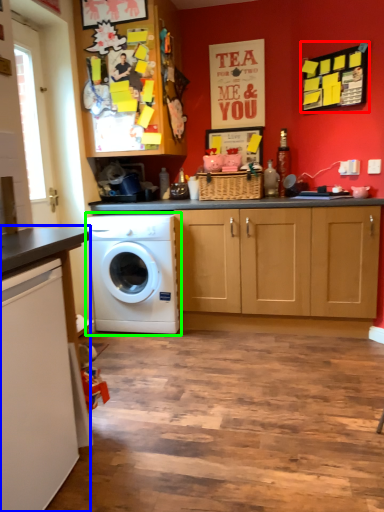
Question: Which object is positioned farthest from bulletin board (highlighted by a red box)? Select from countertop (highlighted by a blue box) and washing machine (highlighted by a green box).

Choices:
 (A) countertop
 (B) washing machine

Answer: (A)